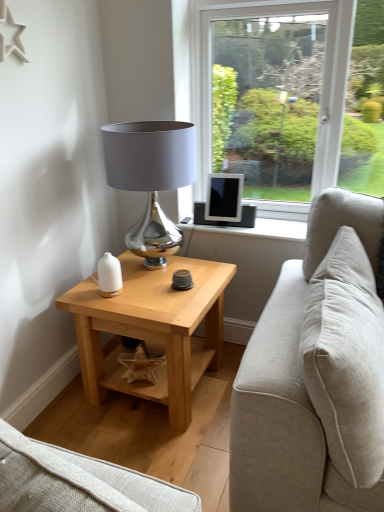
Image resolution: width=384 pixels, height=512 pixels. Find the location of `vacant space underneath shiny metallic lampshade at center (from a real-world perspective)`. vacant space underneath shiny metallic lampshade at center (from a real-world perspective) is located at coordinates [x=150, y=268].